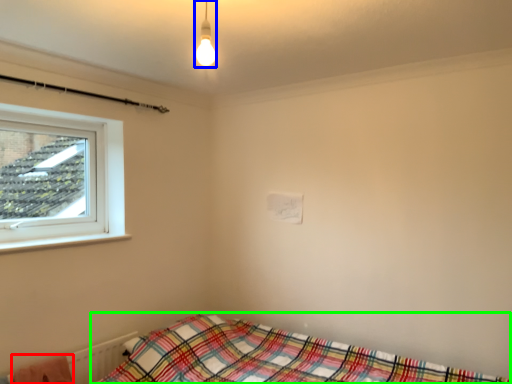
Question: Based on their relative distances, which object is farther from blanket (highlighted by a red box)? Choose from light fixture (highlighted by a blue box) and bed (highlighted by a green box).

Choices:
 (A) light fixture
 (B) bed

Answer: (A)